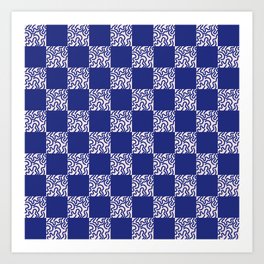
Find the location of a particular element. corners is located at coordinates (238, 25), (25, 24), (25, 237), (238, 238).